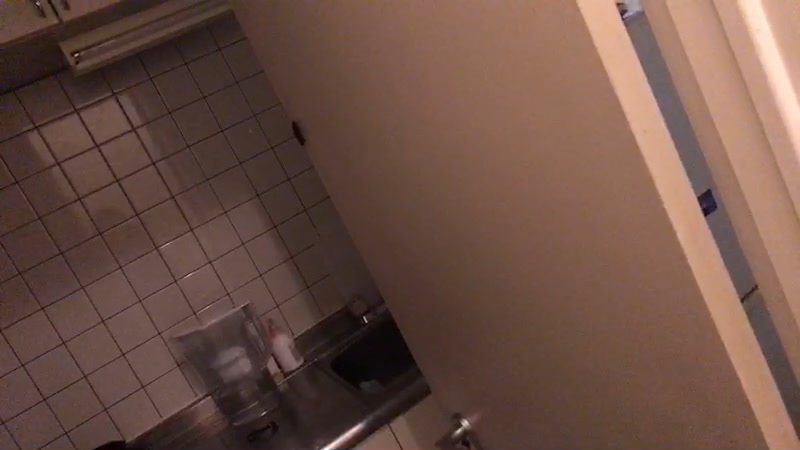
Locate an element on the screen. The width and height of the screenshot is (800, 450). blender container is located at coordinates pos(221,332).